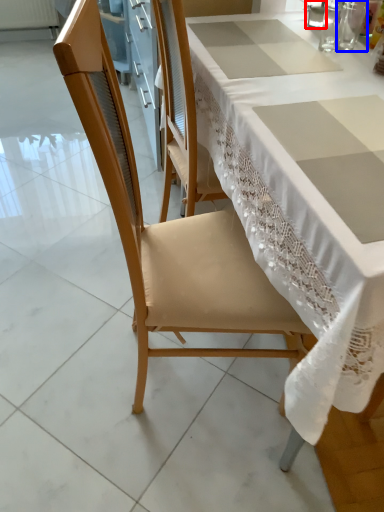
Question: Which object is further to the camera taking this photo, tableware (highlighted by a red box) or tableware (highlighted by a blue box)?

Choices:
 (A) tableware
 (B) tableware

Answer: (A)